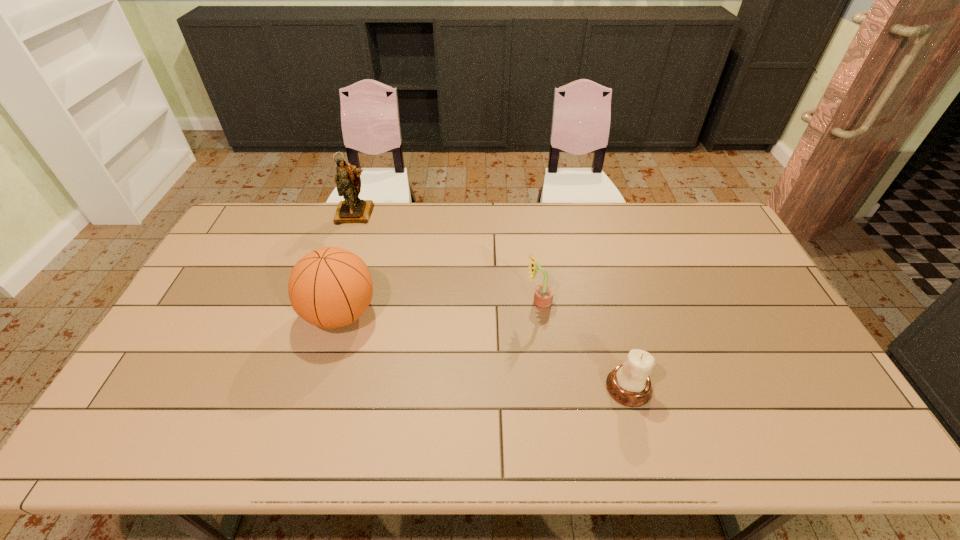
Identify the location of free space located 0.380m on the face of the sunflower. The image size is (960, 540). (399, 303).

Where is `vacant space situated on the left of the candle holder`? This screenshot has height=540, width=960. vacant space situated on the left of the candle holder is located at coordinates point(450,387).

In order to click on object that is at the far edge in this screenshot , I will do `click(352, 210)`.

You are a GUI agent. You are given a task and a screenshot of the screen. Output one action in this format:
    pyautogui.click(x=<x>, y=<y>)
    Task: Click on the vacant area at the far edge
    This screenshot has height=540, width=960.
    Given the screenshot: What is the action you would take?
    pyautogui.click(x=648, y=207)

Locate an element on the screen. The height and width of the screenshot is (540, 960). vacant space at the left edge is located at coordinates (199, 307).

You are a GUI agent. You are given a task and a screenshot of the screen. Output one action in this format:
    pyautogui.click(x=<x>, y=<y>)
    Task: Click on the free space at the right edge
    
    Given the screenshot: What is the action you would take?
    pyautogui.click(x=743, y=255)

You are a GUI agent. You are given a task and a screenshot of the screen. Output one action in this format:
    pyautogui.click(x=<x>, y=<y>)
    Task: Click on the free region at the near right corner of the desktop
    This screenshot has height=540, width=960.
    Given the screenshot: What is the action you would take?
    pyautogui.click(x=815, y=451)

Image resolution: width=960 pixels, height=540 pixels. Identify the location of free area in between the farthest object and the rightmost object. (492, 300).

Locate an element on the screen. Image resolution: width=960 pixels, height=540 pixels. empty space that is in between the shortest object and the second object from right to left is located at coordinates (584, 345).

This screenshot has height=540, width=960. In order to click on unoccupied area between the figurine and the candle holder in this screenshot , I will do `click(492, 300)`.